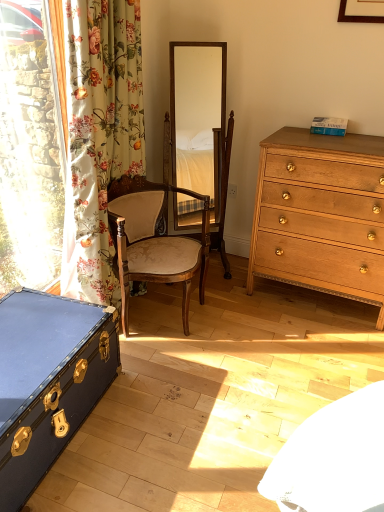
Where is `free spot above blue leather trunk at lower left (from a real-world perspective)`? Image resolution: width=384 pixels, height=512 pixels. free spot above blue leather trunk at lower left (from a real-world perspective) is located at coordinates (41, 335).